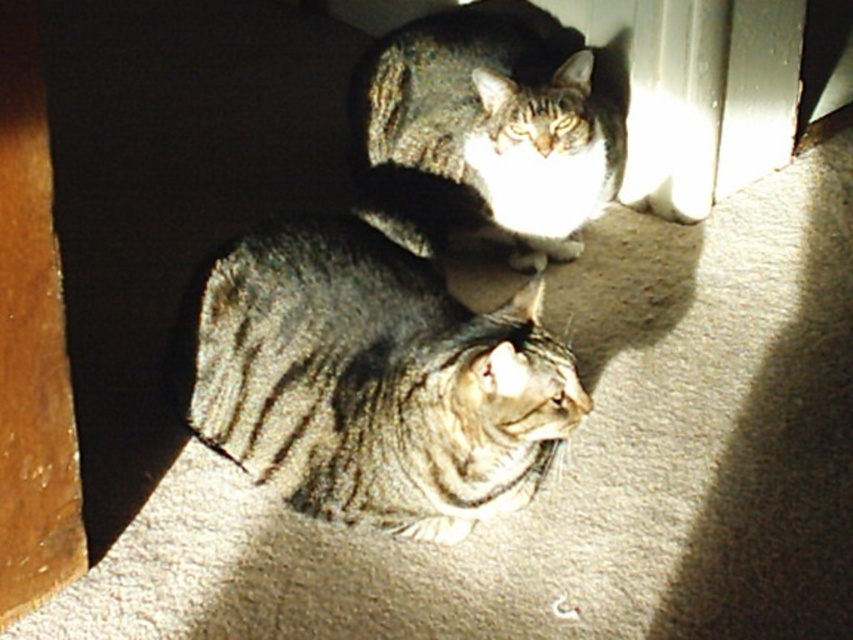
You are a photographer trying to capture both cats in a single shot. Given that the tabby fur cat at lower center and the tabby fur cat at center are different in size, which cat would you need to position closer to the camera to ensure both appear equally sized in the photo?

The tabby fur cat at center should be positioned closer to the camera because it is smaller in width than the tabby fur cat at lower center. By moving the smaller cat closer, their apparent sizes in the photo will balance out.

You are a photographer standing at the camera position. You want to take a closeup photo of the tabby fur cat at lower center. Can you estimate if the cat is within the standard camera focus range of 4 feet?

The tabby fur cat at lower center is 4.35 feet away from camera. Since the standard camera focus range is 4 feet, the cat is slightly beyond the focus range and may appear blurry in the closeup photo.

You are a photographer trying to capture a closeup of the tabby fur cat at lower center without including the tabby fur cat at center in the shot. Given their positions, is this possible?

Yes, since the tabby fur cat at lower center is closer to the viewer than the tabby fur cat at center, you can adjust the camera angle to focus solely on the closer cat while keeping the farther one out of frame.